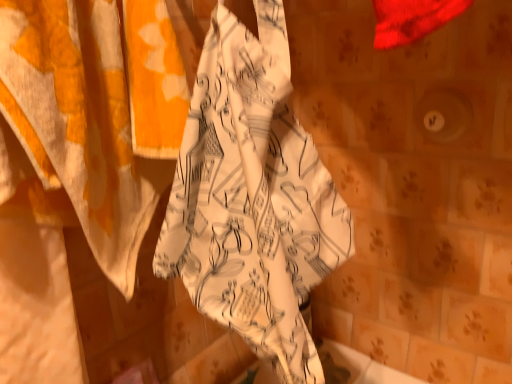
Question: Looking at their shapes, would you say white printed towel at center is wider or thinner than white printed fabric at left?

Choices:
 (A) wide
 (B) thin

Answer: (A)

Question: Choose the correct answer: Is white printed towel at center inside white printed fabric at left or outside it?

Choices:
 (A) inside
 (B) outside

Answer: (B)

Question: From a real-world perspective, is white printed towel at center above or below white printed fabric at left?

Choices:
 (A) above
 (B) below

Answer: (B)

Question: Is white printed fabric at left to the left or to the right of white printed towel at center in the image?

Choices:
 (A) right
 (B) left

Answer: (B)

Question: Considering the positions of white printed fabric at left and white printed towel at center in the image, is white printed fabric at left bigger or smaller than white printed towel at center?

Choices:
 (A) big
 (B) small

Answer: (A)

Question: From the image's perspective, is white printed fabric at left located above or below white printed towel at center?

Choices:
 (A) below
 (B) above

Answer: (A)

Question: From a real-world perspective, is white printed fabric at left physically located above or below white printed towel at center?

Choices:
 (A) below
 (B) above

Answer: (B)